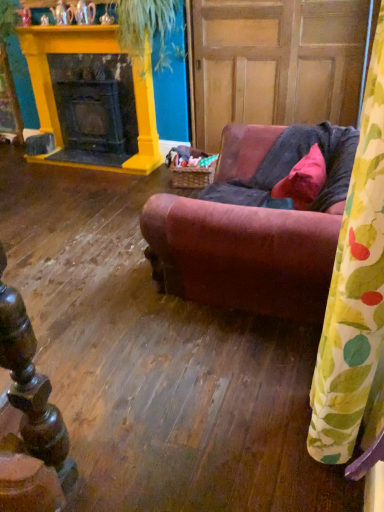
Question: Could you tell me if matte pink fabric pillow at center is turned towards leather couch at center?

Choices:
 (A) yes
 (B) no

Answer: (A)

Question: Considering the relative sizes of matte pink fabric pillow at center and leather couch at center in the image provided, is matte pink fabric pillow at center smaller than leather couch at center?

Choices:
 (A) no
 (B) yes

Answer: (B)

Question: From a real-world perspective, is matte pink fabric pillow at center positioned over leather couch at center based on gravity?

Choices:
 (A) yes
 (B) no

Answer: (A)

Question: Is matte pink fabric pillow at center placed right next to leather couch at center?

Choices:
 (A) yes
 (B) no

Answer: (B)

Question: Is the depth of matte pink fabric pillow at center less than that of leather couch at center?

Choices:
 (A) yes
 (B) no

Answer: (B)

Question: Considering the positions of point (307, 252) and point (142, 23), is point (307, 252) closer or farther from the camera than point (142, 23)?

Choices:
 (A) farther
 (B) closer

Answer: (B)

Question: Considering the positions of leather couch at center and green leafy plant at upper center in the image, is leather couch at center bigger or smaller than green leafy plant at upper center?

Choices:
 (A) big
 (B) small

Answer: (A)

Question: From a real-world perspective, relative to green leafy plant at upper center, is leather couch at center vertically above or below?

Choices:
 (A) above
 (B) below

Answer: (B)

Question: In terms of width, does leather couch at center look wider or thinner when compared to green leafy plant at upper center?

Choices:
 (A) thin
 (B) wide

Answer: (B)

Question: From the image's perspective, is green leafy plant at upper center positioned above or below yellow painted wood fireplace at upper left?

Choices:
 (A) below
 (B) above

Answer: (B)

Question: Visually, is green leafy plant at upper center positioned to the left or to the right of yellow painted wood fireplace at upper left?

Choices:
 (A) left
 (B) right

Answer: (B)

Question: Do you think green leafy plant at upper center is within yellow painted wood fireplace at upper left, or outside of it?

Choices:
 (A) inside
 (B) outside

Answer: (B)

Question: Considering the positions of green leafy plant at upper center and yellow painted wood fireplace at upper left in the image, is green leafy plant at upper center taller or shorter than yellow painted wood fireplace at upper left?

Choices:
 (A) short
 (B) tall

Answer: (A)

Question: From a real-world perspective, is matte pink fabric pillow at center physically located above or below leather couch at center?

Choices:
 (A) above
 (B) below

Answer: (A)

Question: Looking at their shapes, would you say matte pink fabric pillow at center is wider or thinner than leather couch at center?

Choices:
 (A) wide
 (B) thin

Answer: (B)